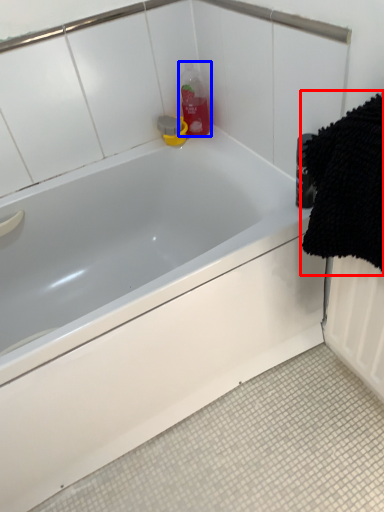
Question: Which of the following is the closest to the observer, bath towel (highlighted by a red box) or cleaning product (highlighted by a blue box)?

Choices:
 (A) bath towel
 (B) cleaning product

Answer: (A)